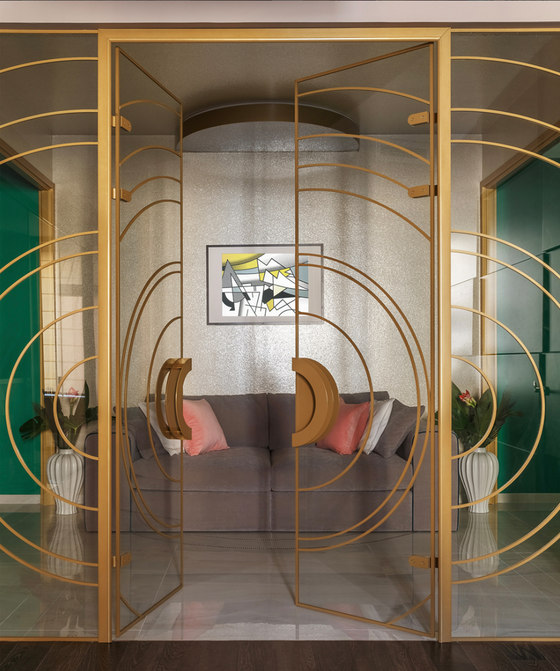
The height and width of the screenshot is (671, 560). What are the coordinates of `green painted wall` in the screenshot? It's located at (515, 241), (21, 323).